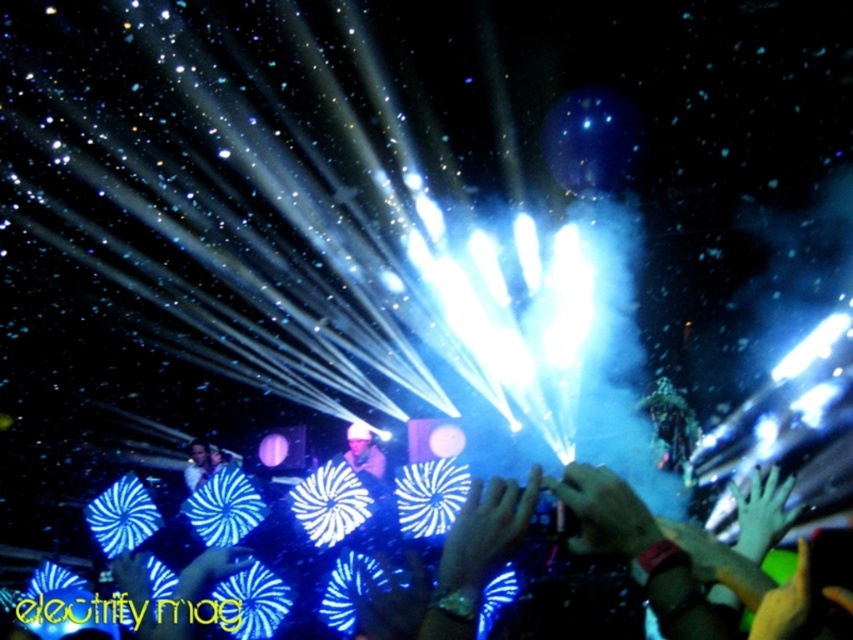
Question: Is blue fabric fan at center closer to the viewer compared to matte black camera at center?

Choices:
 (A) no
 (B) yes

Answer: (B)

Question: Is blue fabric fan at center bigger than matte black camera at center?

Choices:
 (A) yes
 (B) no

Answer: (A)

Question: Which of the following is the farthest from the observer?

Choices:
 (A) matte black camera at center
 (B) blue fabric fan at center

Answer: (A)

Question: Does blue fabric fan at center have a larger size compared to matte black camera at center?

Choices:
 (A) yes
 (B) no

Answer: (A)

Question: Among these points, which one is nearest to the camera?

Choices:
 (A) (142, 573)
 (B) (358, 467)

Answer: (A)